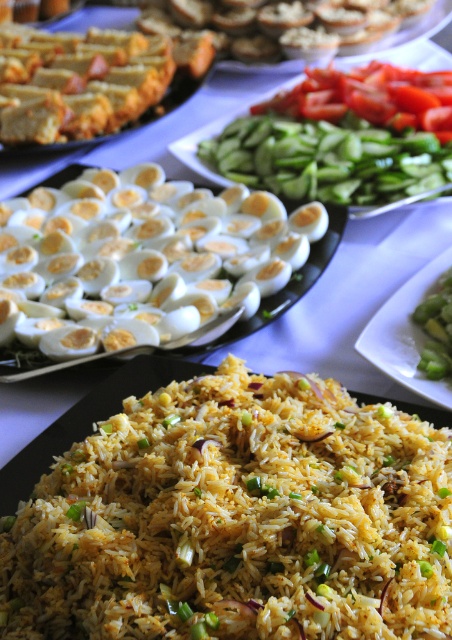
You are standing in front of a buffet table and see two points on the table. The first point is at coordinates point (414, 605) and the second is at point (409, 342). Which point is closer to you?

Point (414, 605) is closer to the viewer than point (409, 342).